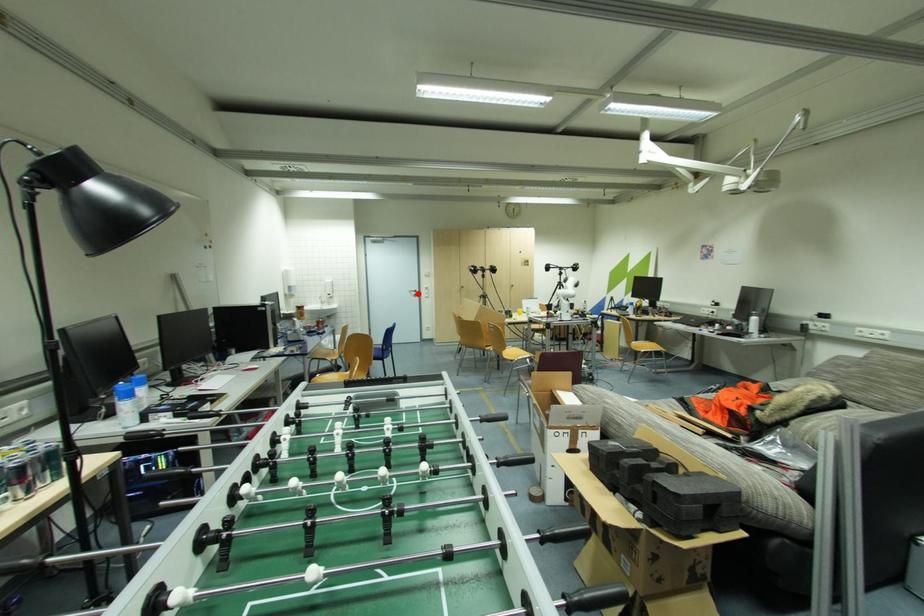
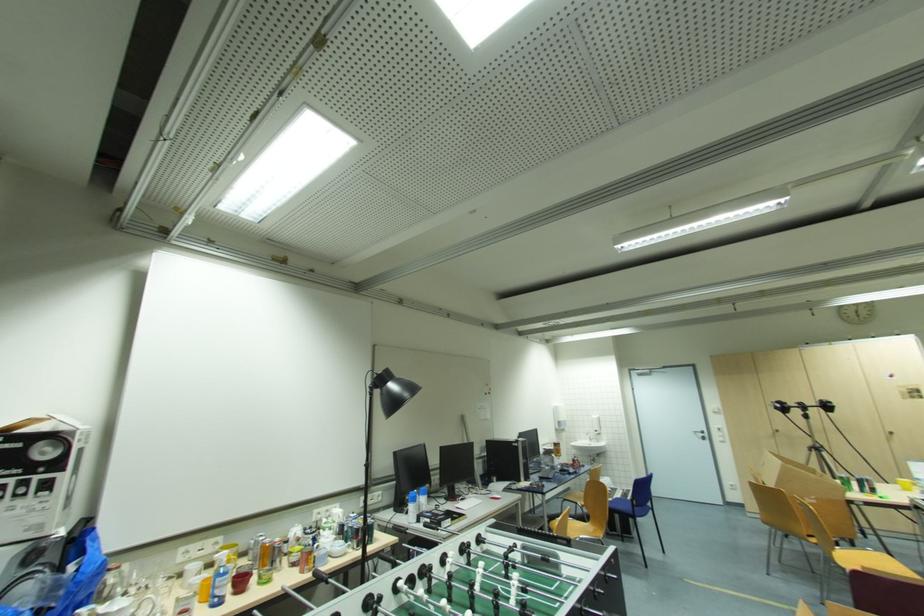
In the second image, find the point that corresponds to the highlighted location in the first image.

(706, 436)